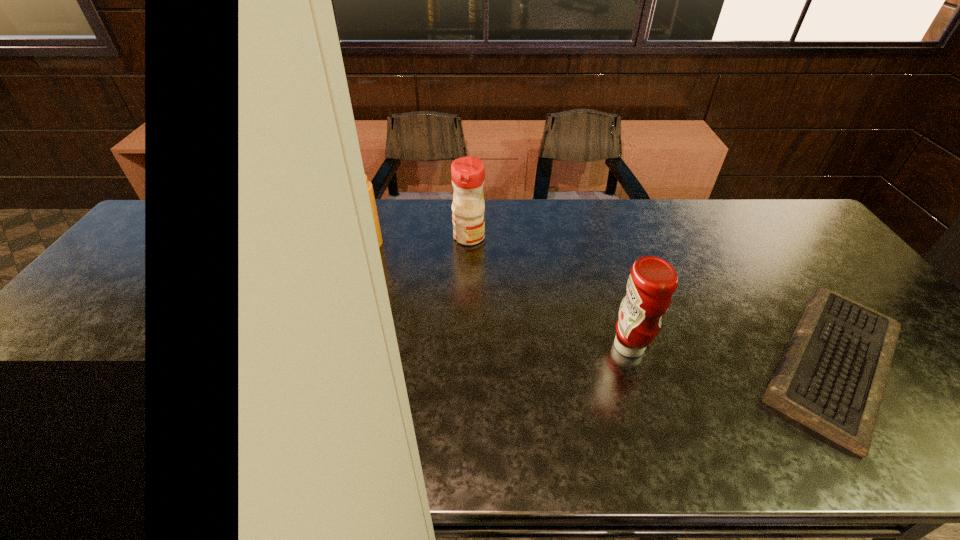
Image resolution: width=960 pixels, height=540 pixels. In order to click on vacant region at the right edge of the desktop in this screenshot , I will do `click(831, 280)`.

You are a GUI agent. You are given a task and a screenshot of the screen. Output one action in this format:
    pyautogui.click(x=<x>, y=<y>)
    Task: Click on the free region at the far right corner of the desktop
    This screenshot has width=960, height=540.
    Given the screenshot: What is the action you would take?
    pyautogui.click(x=801, y=235)

The width and height of the screenshot is (960, 540). I want to click on free space between the nearest condiment and the second condiment from right to left, so click(549, 292).

At what (x,y) coordinates should I click in order to perform the action: click on free space between the rightmost condiment and the second condiment from left to right. Please return your answer as a coordinate pair (x, y). The image size is (960, 540). Looking at the image, I should click on (549, 292).

The height and width of the screenshot is (540, 960). I want to click on free space between the leftmost condiment and the nearest condiment, so click(x=499, y=295).

Find the location of a particular element. The width and height of the screenshot is (960, 540). vacant point located between the leftmost object and the second condiment from left to right is located at coordinates (420, 240).

What are the coordinates of `object that is the third closest to the nearest condiment` in the screenshot? It's located at (369, 185).

The width and height of the screenshot is (960, 540). I want to click on the third closest object to the third object from left to right, so click(x=369, y=185).

Find the location of a particular element. This screenshot has height=540, width=960. the closest condiment to the nearest condiment is located at coordinates (468, 173).

Locate an element on the screen. The height and width of the screenshot is (540, 960). the closest condiment to the shortest object is located at coordinates (652, 281).